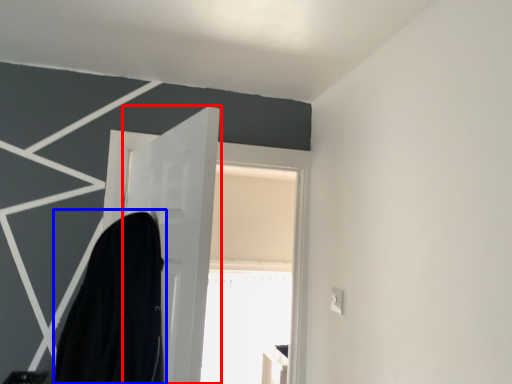
Question: Which object is closer to the camera taking this photo, door (highlighted by a red box) or robe (highlighted by a blue box)?

Choices:
 (A) door
 (B) robe

Answer: (B)